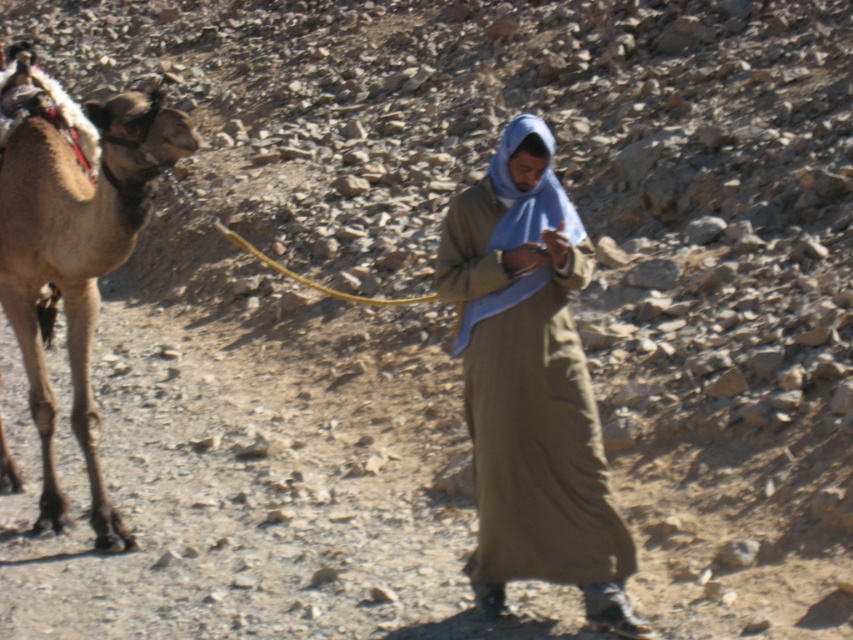
You are standing at the point marked as point (527, 372) in the desert scene. What object is located exactly at your current position?

The olive green fabric robe at center is located exactly at point (527, 372).